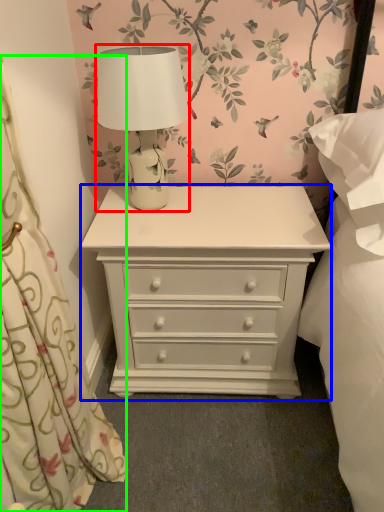
Question: Based on their relative distances, which object is nearer to table lamp (highlighted by a red box)? Choose from chest of drawers (highlighted by a blue box) and curtain (highlighted by a green box).

Choices:
 (A) chest of drawers
 (B) curtain

Answer: (A)